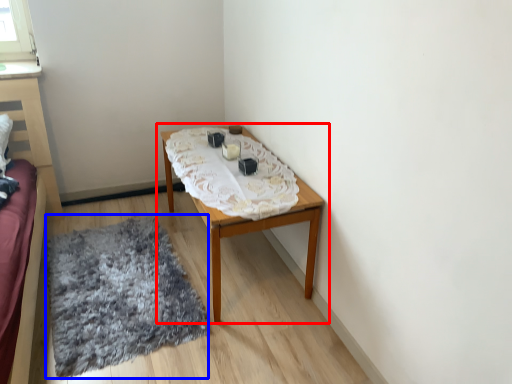
Question: Which of the following is the closest to the observer, table (highlighted by a red box) or mat (highlighted by a blue box)?

Choices:
 (A) table
 (B) mat

Answer: (B)